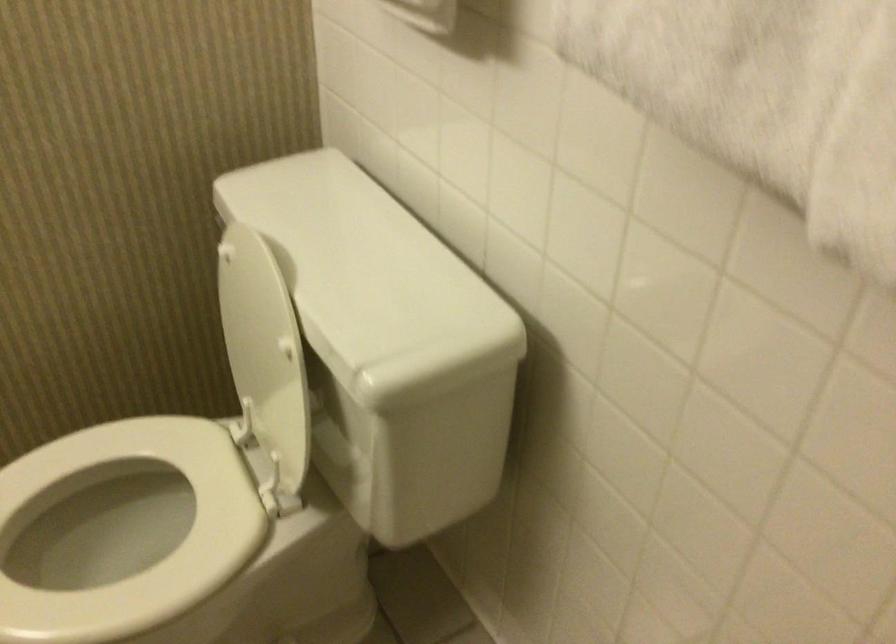
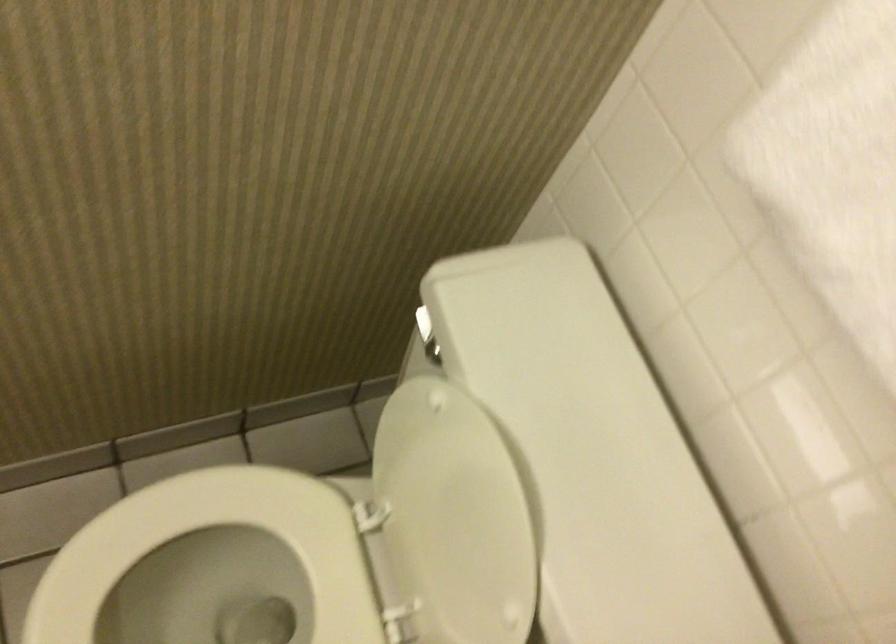
Find the pixel in the second image that matches point (254, 330) in the first image.

(453, 518)